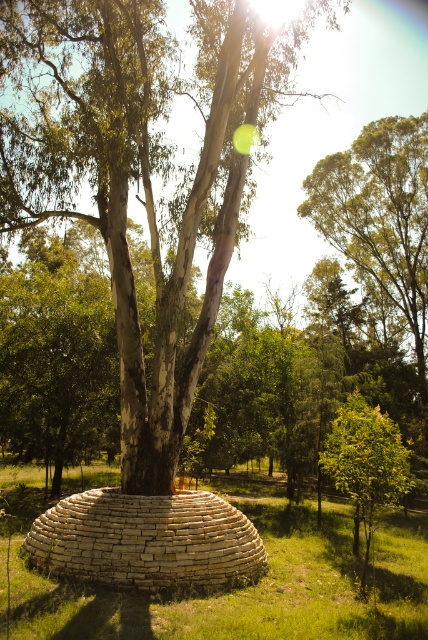
Can you confirm if smooth bark tree at center is smaller than white stone dome at center?

Actually, smooth bark tree at center might be larger than white stone dome at center.

Can you confirm if smooth bark tree at center is positioned to the right of white stone dome at center?

No, smooth bark tree at center is not to the right of white stone dome at center.

Where is `smooth bark tree at center`? The height and width of the screenshot is (640, 428). smooth bark tree at center is located at coordinates (142, 168).

I want to click on smooth bark tree at center, so click(x=142, y=168).

Looking at this image, does smooth bark tree at center have a lesser height compared to green leafy tree at center?

No.

The image size is (428, 640). Describe the element at coordinates (142, 168) in the screenshot. I see `smooth bark tree at center` at that location.

Find the location of a particular element. smooth bark tree at center is located at coordinates (142, 168).

Between point (183, 624) and point (418, 228), which one is positioned in front?

Point (183, 624)

Consider the image. Does white stone dome at center appear on the left side of green leafy tree at upper center?

Indeed, white stone dome at center is positioned on the left side of green leafy tree at upper center.

Between point (32, 604) and point (400, 260), which one is positioned behind?

The point (400, 260) is behind.

Find the location of a particular element. The height and width of the screenshot is (640, 428). white stone dome at center is located at coordinates (199, 595).